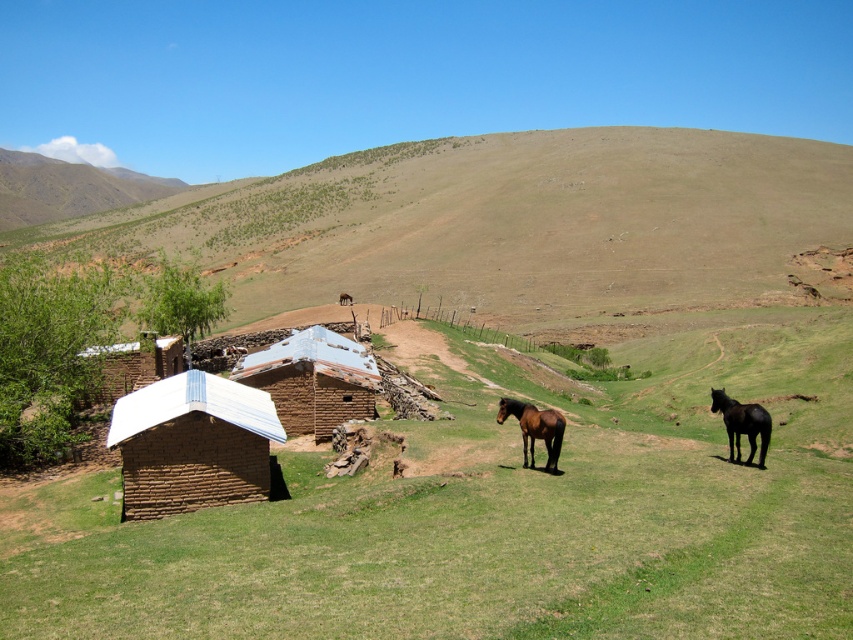
Question: Can you confirm if brown mud brick field at center is positioned below brown glossy horse at lower center?

Choices:
 (A) yes
 (B) no

Answer: (B)

Question: Is brown brick hut at center smaller than brown clay hut at lower left?

Choices:
 (A) yes
 (B) no

Answer: (A)

Question: Which object appears farthest from the camera in this image?

Choices:
 (A) brown mud brick field at center
 (B) black glossy horse at right
 (C) brown brick hut at center
 (D) brown clay hut at lower left

Answer: (D)

Question: Estimate the real-world distances between objects in this image. Which object is closer to the brown brick hut at center?

Choices:
 (A) brown grassy hillside at upper center
 (B) black glossy horse at right
 (C) brown glossy horse at lower center
 (D) brown mud brick field at center

Answer: (D)

Question: Can you confirm if brown mud brick field at center is thinner than brown clay hut at lower left?

Choices:
 (A) no
 (B) yes

Answer: (A)

Question: Which of the following is the farthest from the observer?

Choices:
 (A) brown brick hut at center
 (B) black glossy horse at right
 (C) brown glossy horse at lower center
 (D) brown clay hut at lower left

Answer: (D)